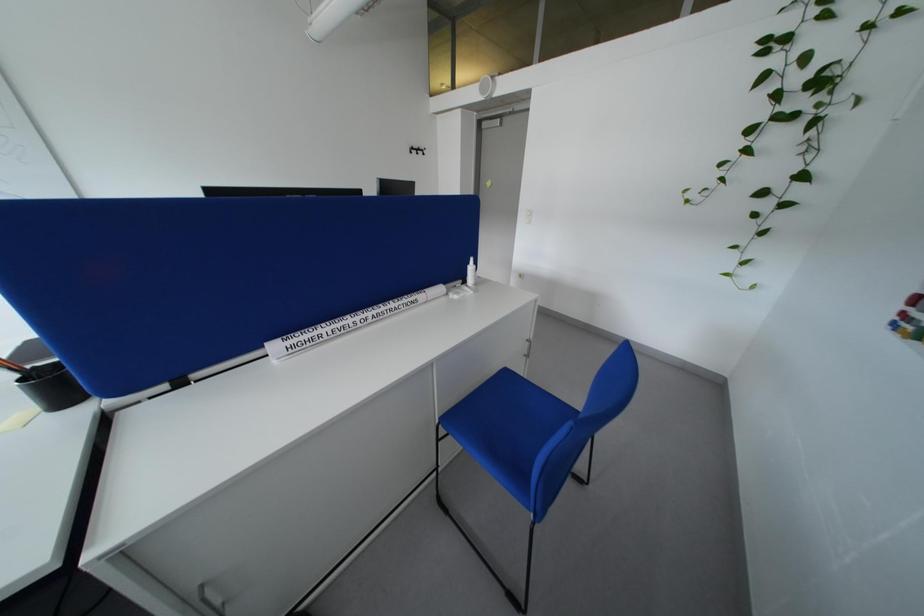
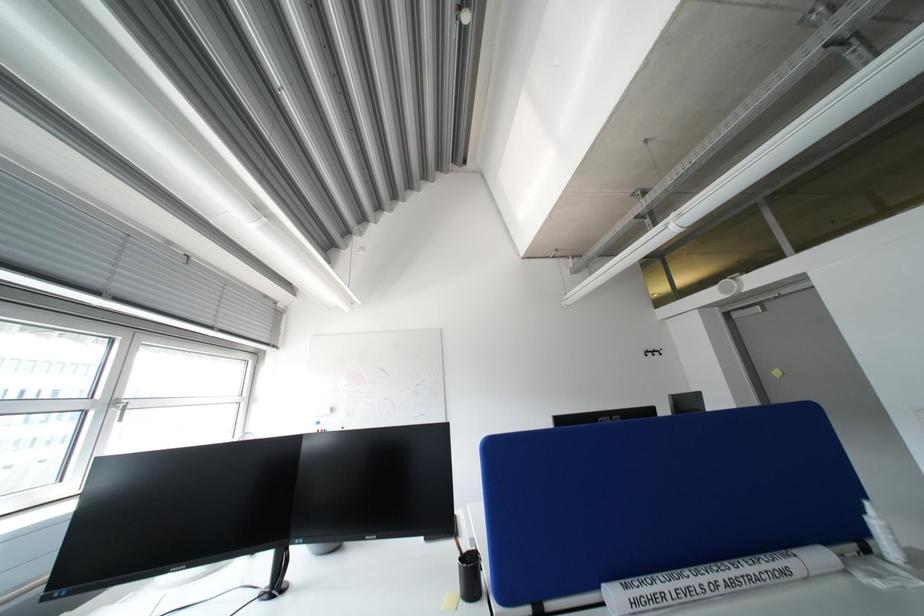
How did the camera likely rotate?

The rotation direction of the camera is left-up.